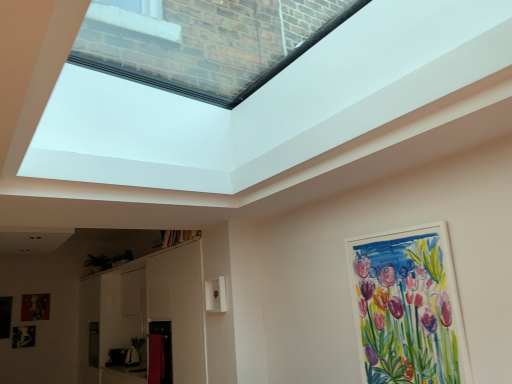
Identify the location of empty space that is ontop of white matte picture frame at upper right, marked as the third picture frame in a left-to-right arrangement (from a real-world perspective). (387, 227).